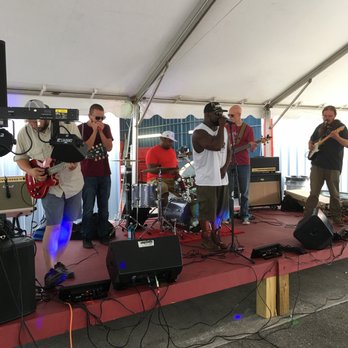
At what (x,y) coordinates should I click in order to perform the action: click on wooden support. Please return your answer as a coordinate pair (x, y). The height and width of the screenshot is (348, 348). Looking at the image, I should click on (271, 294), (283, 292).